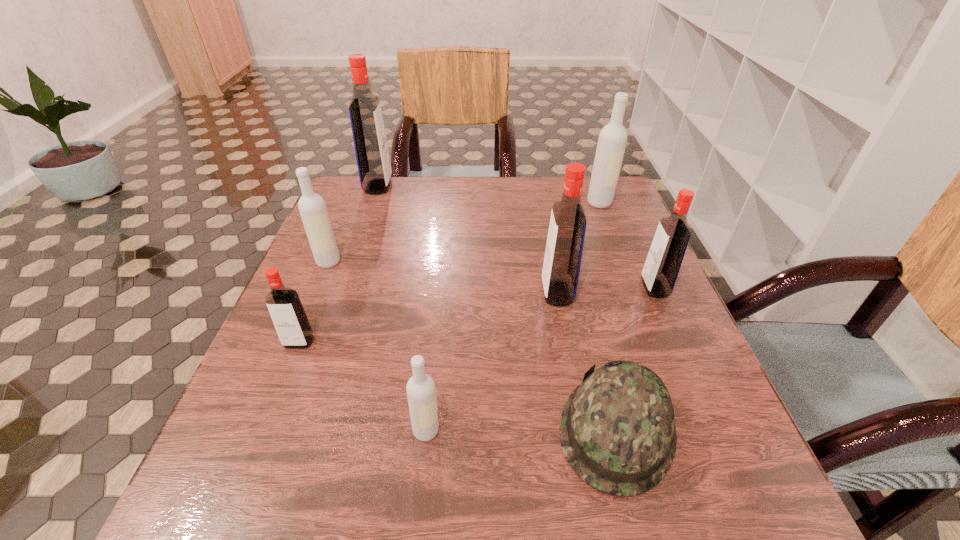
The width and height of the screenshot is (960, 540). Identify the location of free area in between the shortest object and the tallest vodka. (497, 308).

You are a GUI agent. You are given a task and a screenshot of the screen. Output one action in this format:
    pyautogui.click(x=<x>, y=<y>)
    Task: Click on the vacant space that is in between the leftmost white vodka and the second biggest red vodka
    Image resolution: width=960 pixels, height=540 pixels.
    Given the screenshot: What is the action you would take?
    pyautogui.click(x=443, y=278)

Identify the location of free space that is in between the fifth vodka from left to right and the headwear. (587, 361).

Identify the location of free space between the rightmost red vodka and the biggest red vodka. This screenshot has height=540, width=960. (516, 237).

At what (x,y) coordinates should I click in order to perform the action: click on empty location between the smallest red vodka and the tallest vodka. Please return your answer as a coordinate pair (x, y). The image size is (960, 540). Looking at the image, I should click on (339, 265).

Locate an element on the screen. object that is the second closest to the shortest object is located at coordinates (421, 393).

Locate an element on the screen. object that is the closest to the nearest vodka is located at coordinates (617, 430).

This screenshot has width=960, height=540. Find the location of `the second closest vodka to the headwear`. the second closest vodka to the headwear is located at coordinates (421, 393).

Select which vodka appears as the sixth closest to the headwear. Please provide its 2D coordinates. Your answer should be formatted as a tuple, i.e. [(x, y)], where the tuple contains the x and y coordinates of a point satisfying the conditions above.

[(612, 140)]

Locate an element on the screen. This screenshot has height=540, width=960. the closest red vodka to the third vodka from right to left is located at coordinates (662, 265).